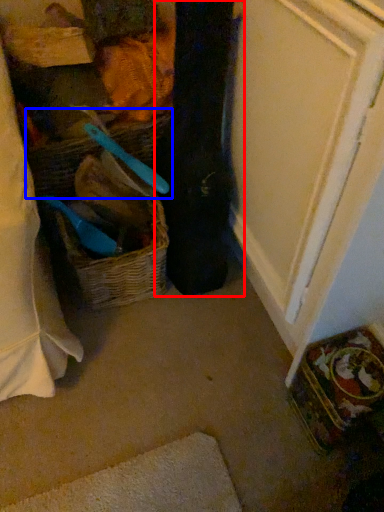
Question: Among these objects, which one is nearest to the camera, clothing (highlighted by a red box) or basket (highlighted by a blue box)?

Choices:
 (A) clothing
 (B) basket

Answer: (A)